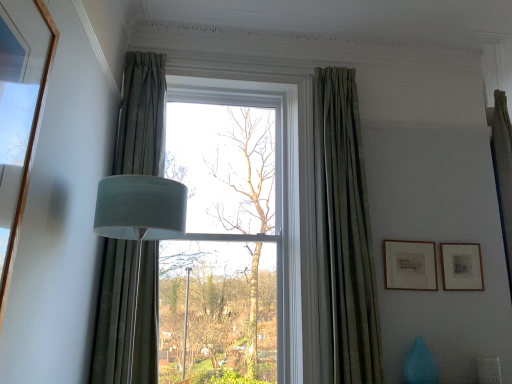
Question: Is green fabric curtain at left, which is the first curtain from left to right, behind matte blue vase at lower right?

Choices:
 (A) yes
 (B) no

Answer: (B)

Question: From the image's perspective, is green fabric curtain at left, which is the first curtain from left to right, beneath matte blue vase at lower right?

Choices:
 (A) no
 (B) yes

Answer: (A)

Question: Can matte blue vase at lower right be found inside green fabric curtain at left, which is the first curtain from left to right?

Choices:
 (A) no
 (B) yes

Answer: (A)

Question: Does green fabric curtain at left, positioned as the 2th curtain in right-to-left order, have a larger size compared to matte blue vase at lower right?

Choices:
 (A) no
 (B) yes

Answer: (B)

Question: Does green fabric curtain at left, which is the first curtain from left to right, lie in front of matte blue vase at lower right?

Choices:
 (A) yes
 (B) no

Answer: (A)

Question: In the image, is matte gold picture frame at right, the second picture frame in the right-to-left sequence, on the left side or the right side of green velvet curtain at center, which is the first curtain in right-to-left order?

Choices:
 (A) left
 (B) right

Answer: (B)

Question: Is matte gold picture frame at right, arranged as the first picture frame when viewed from the left, inside the boundaries of green velvet curtain at center, acting as the second curtain starting from the left, or outside?

Choices:
 (A) outside
 (B) inside

Answer: (A)

Question: Is point (428, 276) closer or farther from the camera than point (360, 380)?

Choices:
 (A) farther
 (B) closer

Answer: (A)

Question: Is matte gold picture frame at right, the second picture frame in the right-to-left sequence, wider or thinner than green velvet curtain at center, which is the first curtain in right-to-left order?

Choices:
 (A) wide
 (B) thin

Answer: (B)

Question: Is matte black picture frame at right, which ranks as the second picture frame in left-to-right order, situated inside green velvet curtain at center, which is the first curtain in right-to-left order, or outside?

Choices:
 (A) outside
 (B) inside

Answer: (A)

Question: From the image's perspective, is matte black picture frame at right, which appears as the first picture frame when viewed from the right, above or below green velvet curtain at center, acting as the second curtain starting from the left?

Choices:
 (A) above
 (B) below

Answer: (B)

Question: Is matte black picture frame at right, which appears as the first picture frame when viewed from the right, taller or shorter than green velvet curtain at center, which is the first curtain in right-to-left order?

Choices:
 (A) tall
 (B) short

Answer: (B)

Question: From a real-world perspective, relative to green velvet curtain at center, which is the first curtain in right-to-left order, is matte black picture frame at right, which ranks as the second picture frame in left-to-right order, vertically above or below?

Choices:
 (A) above
 (B) below

Answer: (B)

Question: Is matte blue vase at lower right bigger or smaller than matte black picture frame at right, which ranks as the second picture frame in left-to-right order?

Choices:
 (A) small
 (B) big

Answer: (B)

Question: Relative to matte black picture frame at right, which ranks as the second picture frame in left-to-right order, is matte blue vase at lower right in front or behind?

Choices:
 (A) behind
 (B) front

Answer: (B)